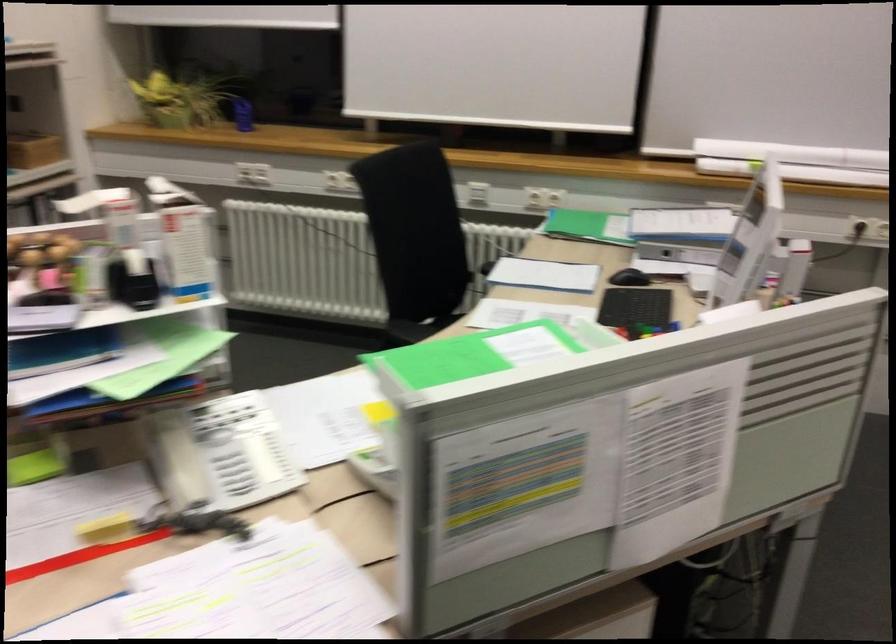
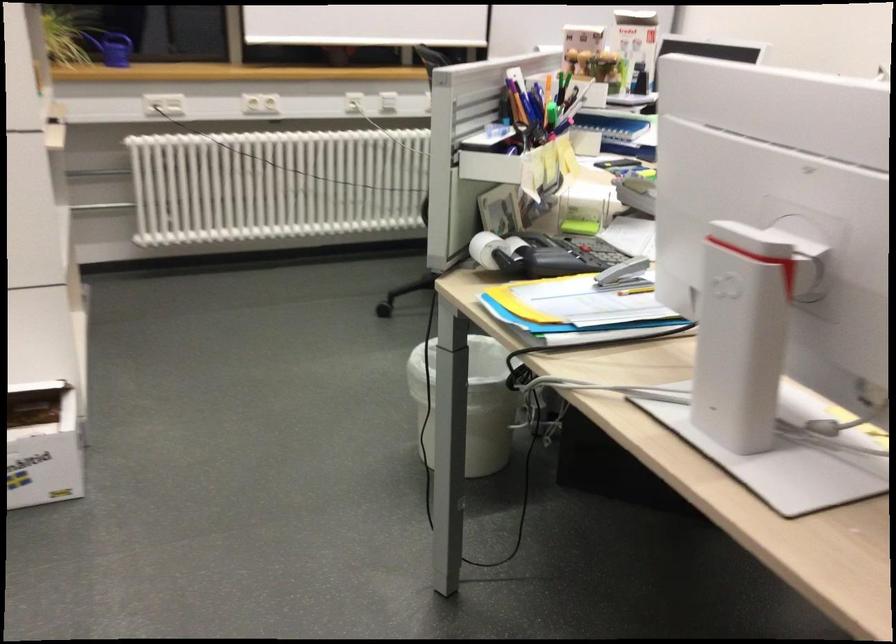
Find the pixel in the second image that matches (x=254, y=114) in the first image.

(112, 48)